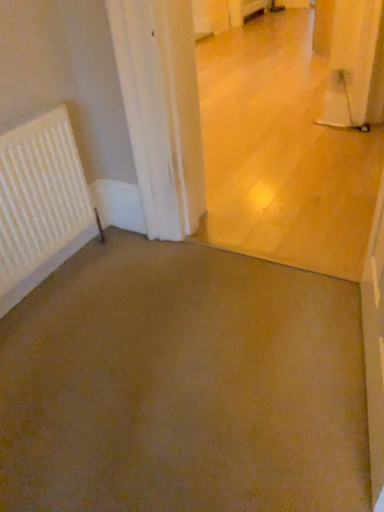
I want to click on vacant area to the right of white matte radiator at left, so click(139, 277).